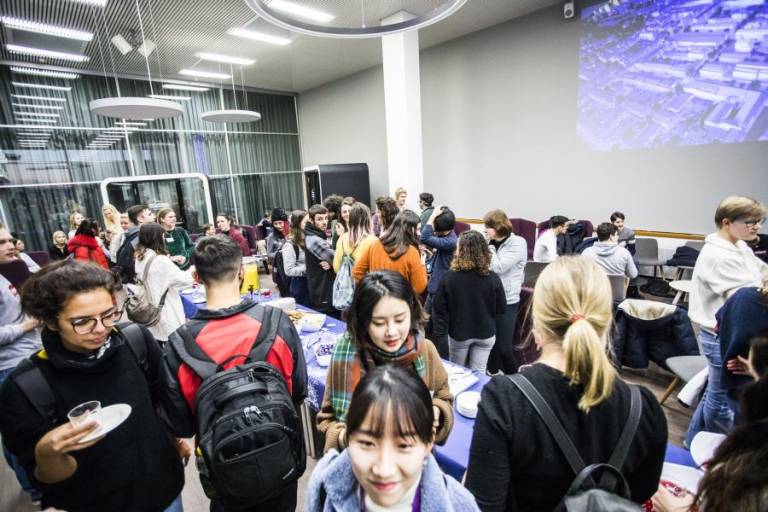
At what (x,y) coordinates should I click in order to perform the action: click on tablecloths. Please return your answer as a coordinate pair (x, y). Image resolution: width=768 pixels, height=512 pixels. Looking at the image, I should click on (455, 447), (192, 307).